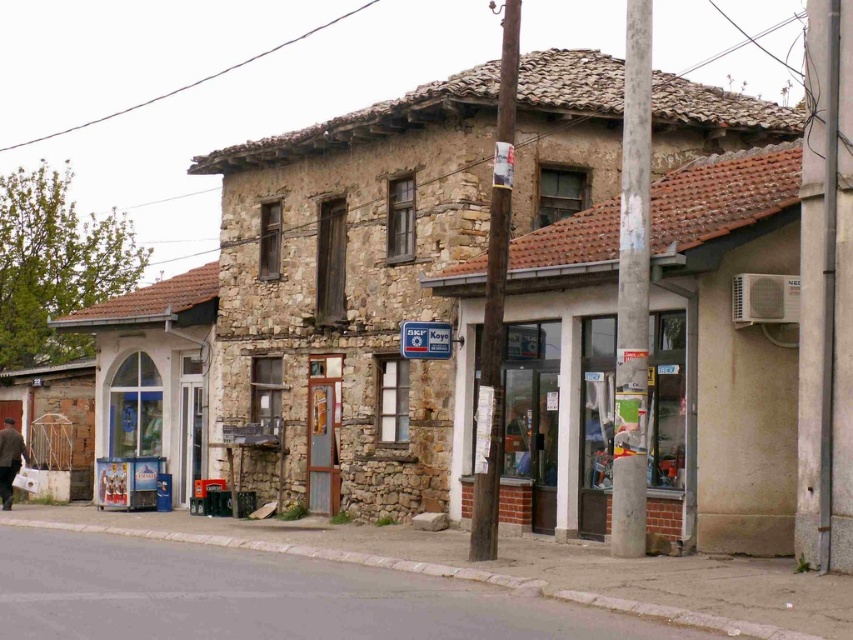
From the picture: You are a delivery person standing at the brown wool coat at lower left position. You need to deliver a package to the clear glass door at center. Can you walk straight towards it without any obstacles between you and the door?

The clear glass door at center is 12.62 meters away from the brown wool coat at lower left. Since there are no obstacles mentioned in the scene description between them, you can walk straight towards the door.

Consider the image. You are a delivery person trying to enter the SKF Koyo shop. You see the clear glass door at center and the brown wool coat at lower left. Which object is larger and can you use the larger one to enter the shop?

The clear glass door at center is bigger than the brown wool coat at lower left. You can use the clear glass door at center to enter the shop since it is the larger object and likely the entrance.